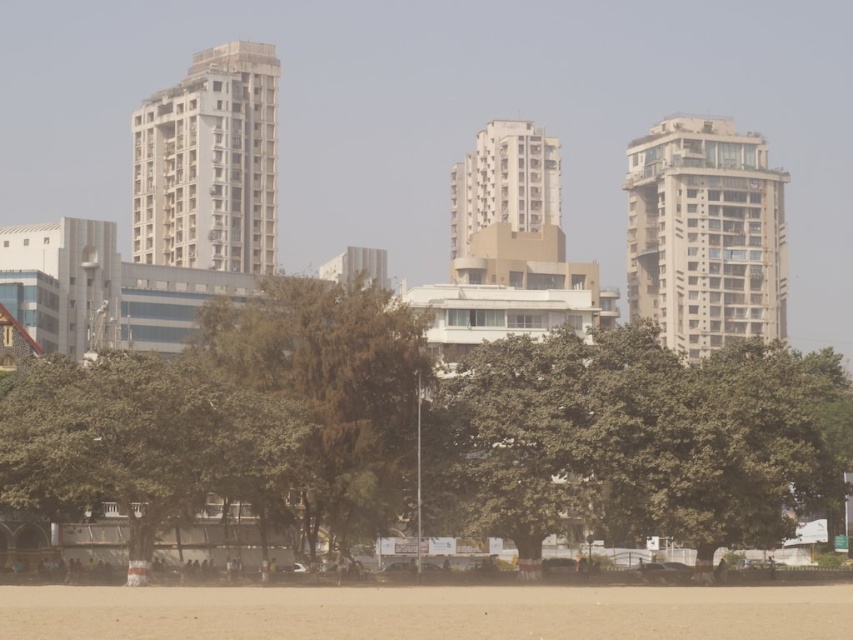
You are standing in the city park and notice the green leafy tree at center and the beige concrete building at center. Which object is positioned lower in the image?

The green leafy tree at center is located below the beige concrete building at center, so it is positioned lower in the image.

You are standing at the point with coordinates point [175,148] and want to walk towards the point with coordinates point [682,131]. Which direction should you move to reach your destination?

You should move north to reach point [682,131] from point [175,148] because the destination is behind the starting point, indicating a northerly direction.